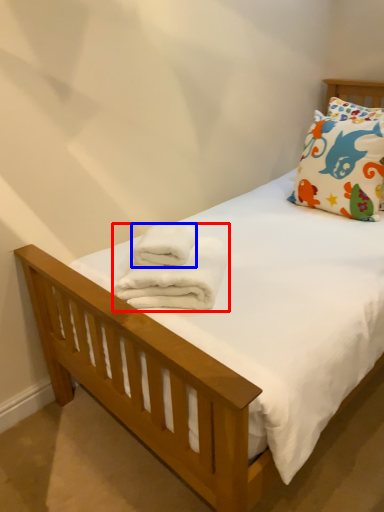
Question: Which of the following is the farthest to the observer, bath towel (highlighted by a red box) or bath towel (highlighted by a blue box)?

Choices:
 (A) bath towel
 (B) bath towel

Answer: (B)